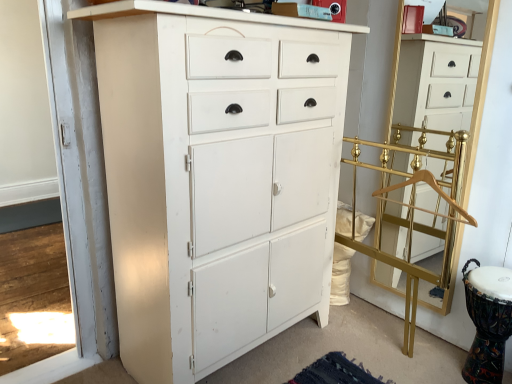
What are the coordinates of `blank area to the left of gold metallic coat rack at right` in the screenshot? It's located at (296, 355).